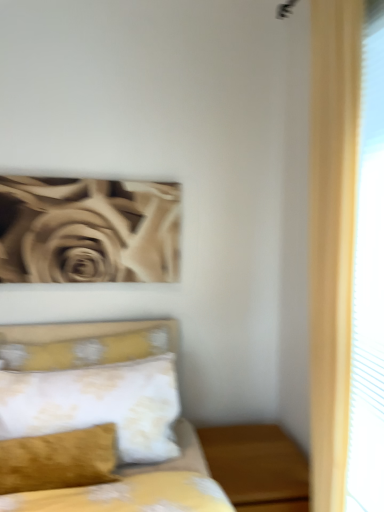
The height and width of the screenshot is (512, 384). What are the coordinates of `empty space that is ontop of beige textured rose at upper left (from a real-world perspective)` in the screenshot? It's located at (80, 173).